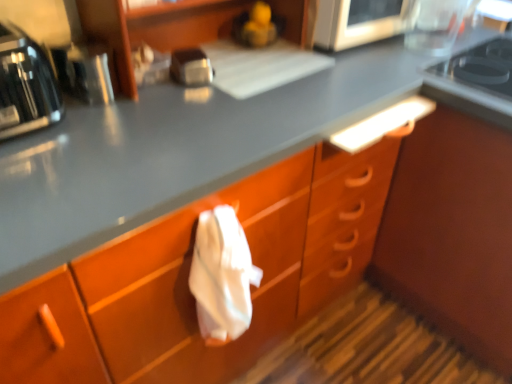
Question: From a real-world perspective, is metallic silver microwave at upper center, acting as the first appliance starting from the right, located higher than metallic silver toaster at left, which is counted as the second appliance, starting from the back?

Choices:
 (A) no
 (B) yes

Answer: (B)

Question: Is metallic silver microwave at upper center, which is counted as the second appliance, starting from the bottom, behind metallic silver toaster at left, which ranks as the second appliance in right-to-left order?

Choices:
 (A) no
 (B) yes

Answer: (B)

Question: Is metallic silver toaster at left, which is counted as the second appliance, starting from the back, at the back of metallic silver microwave at upper center, which is counted as the second appliance, starting from the bottom?

Choices:
 (A) no
 (B) yes

Answer: (A)

Question: From the image's perspective, is metallic silver microwave at upper center, placed as the 1th appliance when sorted from back to front, located beneath metallic silver toaster at left, which is the first appliance from left to right?

Choices:
 (A) no
 (B) yes

Answer: (A)

Question: Are metallic silver microwave at upper center, which is counted as the second appliance, starting from the bottom, and metallic silver toaster at left, the first appliance in the front-to-back sequence, far apart?

Choices:
 (A) no
 (B) yes

Answer: (A)

Question: Considering the relative sizes of metallic silver microwave at upper center, placed as the 1th appliance when sorted from back to front, and metallic silver toaster at left, the first appliance in the front-to-back sequence, in the image provided, is metallic silver microwave at upper center, placed as the 1th appliance when sorted from back to front, shorter than metallic silver toaster at left, the first appliance in the front-to-back sequence,?

Choices:
 (A) yes
 (B) no

Answer: (B)

Question: Can you confirm if black glass gas stove at upper right is thinner than metallic silver microwave at upper center, arranged as the first appliance when viewed from the top?

Choices:
 (A) yes
 (B) no

Answer: (B)

Question: From the image's perspective, is black glass gas stove at upper right located above metallic silver microwave at upper center, placed as the 1th appliance when sorted from back to front?

Choices:
 (A) no
 (B) yes

Answer: (A)

Question: Is black glass gas stove at upper right positioned with its back to metallic silver microwave at upper center, placed as the 2th appliance when sorted from left to right?

Choices:
 (A) no
 (B) yes

Answer: (A)

Question: Does black glass gas stove at upper right have a greater width compared to metallic silver microwave at upper center, placed as the 1th appliance when sorted from back to front?

Choices:
 (A) yes
 (B) no

Answer: (A)

Question: From the image's perspective, is black glass gas stove at upper right below metallic silver microwave at upper center, placed as the 2th appliance when sorted from left to right?

Choices:
 (A) yes
 (B) no

Answer: (A)

Question: Could you tell me if black glass gas stove at upper right is turned towards metallic silver microwave at upper center, which is counted as the second appliance, starting from the bottom?

Choices:
 (A) no
 (B) yes

Answer: (A)

Question: From the image's perspective, would you say satin silver toaster at upper center is shown under black glass gas stove at upper right?

Choices:
 (A) yes
 (B) no

Answer: (A)